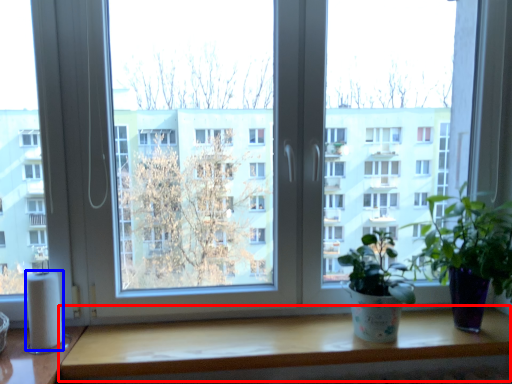
Question: Which of the following is the farthest to the observer, table (highlighted by a red box) or toilet paper (highlighted by a blue box)?

Choices:
 (A) table
 (B) toilet paper

Answer: (B)